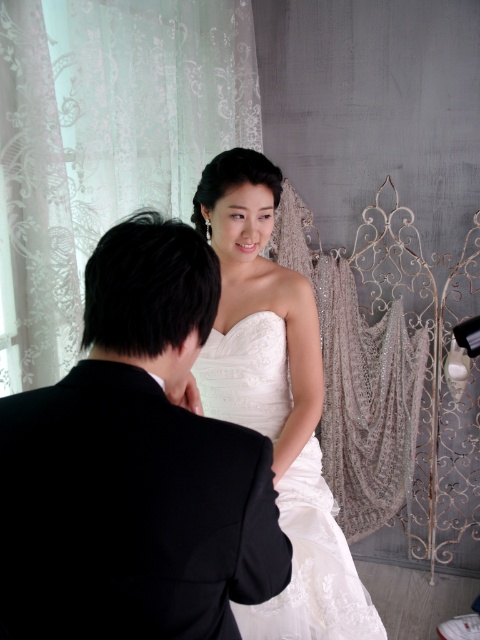
Question: Is the position of black satin suit at center less distant than that of satin/embroidered dress at center?

Choices:
 (A) no
 (B) yes

Answer: (B)

Question: Is black satin suit at center bigger than satin/embroidered dress at center?

Choices:
 (A) no
 (B) yes

Answer: (A)

Question: Which object appears farthest from the camera in this image?

Choices:
 (A) black satin suit at center
 (B) satin/embroidered dress at center

Answer: (B)

Question: Is black satin suit at center below satin/embroidered dress at center?

Choices:
 (A) no
 (B) yes

Answer: (A)

Question: Which of the following is the closest to the observer?

Choices:
 (A) black satin suit at center
 (B) satin/embroidered dress at center

Answer: (A)